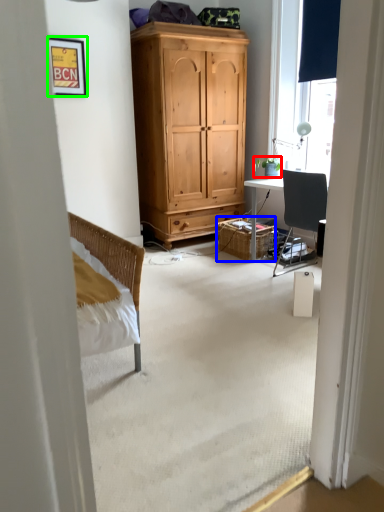
Question: Which object is the closest to the houseplant (highlighted by a red box)? Choose among these: picnic basket (highlighted by a blue box) or picture frame (highlighted by a green box).

Choices:
 (A) picnic basket
 (B) picture frame

Answer: (A)